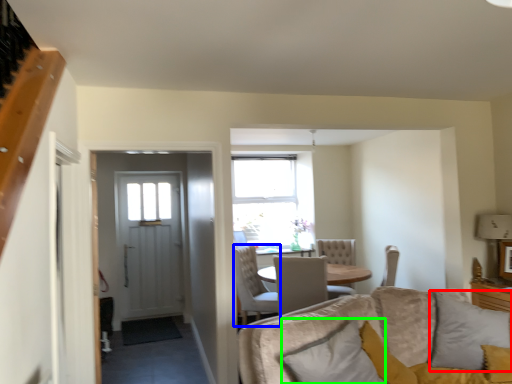
Question: Estimate the real-world distances between objects in this image. Which object is farther from pillow (highlighted by a red box), chair (highlighted by a blue box) or pillow (highlighted by a green box)?

Choices:
 (A) chair
 (B) pillow

Answer: (A)